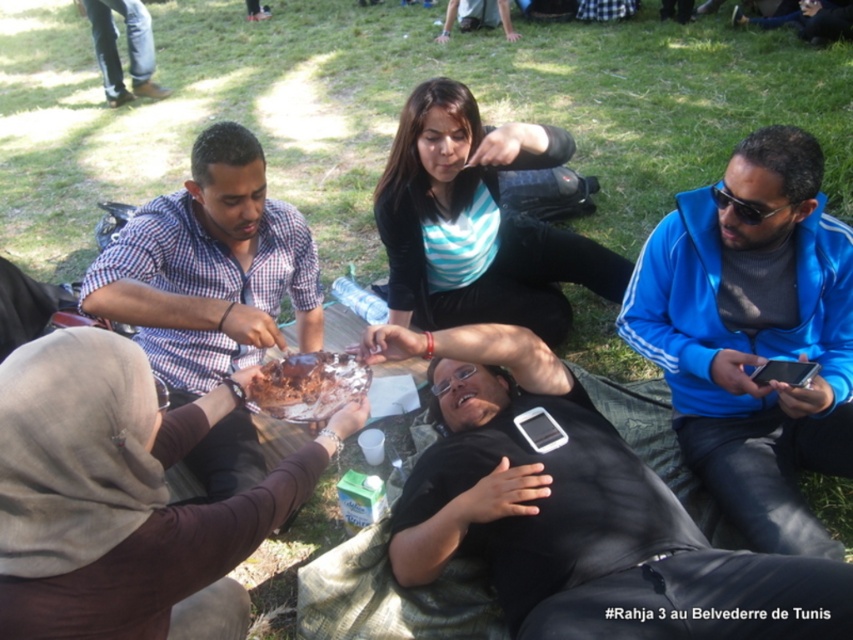
You are organizing a picnic and want to place both the black matte phone at center and the brown matte cake at center on a small tray. Given their sizes, which item should you place first to ensure they both fit?

Since the black matte phone at center is wider than the brown matte cake at center, you should place the larger item first, so place the black matte phone at center first to ensure both fit on the tray.

You are a photographer trying to capture a group photo of the people at the gathering. You want to ensure both the blue fleece jacket at right and the checkered fabric shirt at left are clearly visible in the frame. Based on their positions, which direction should you position yourself relative to the group to best include both individuals in the shot?

You should position yourself to the left of the group so that both the blue fleece jacket at right and the checkered fabric shirt at left are visible in the frame. Since the blue fleece jacket at right is to the right of the checkered fabric shirt at left, positioning yourself to the left would allow you to capture both individuals within the camera frame.